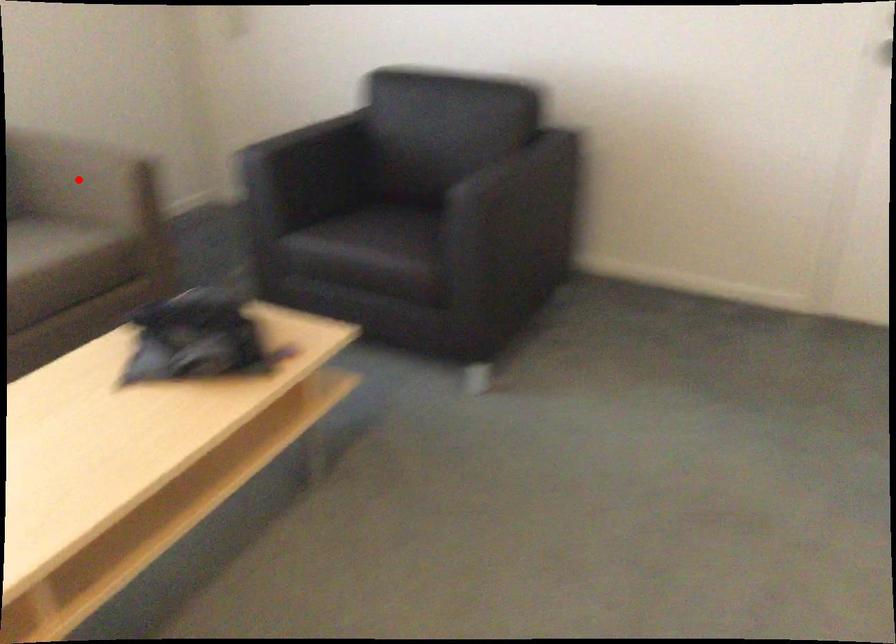
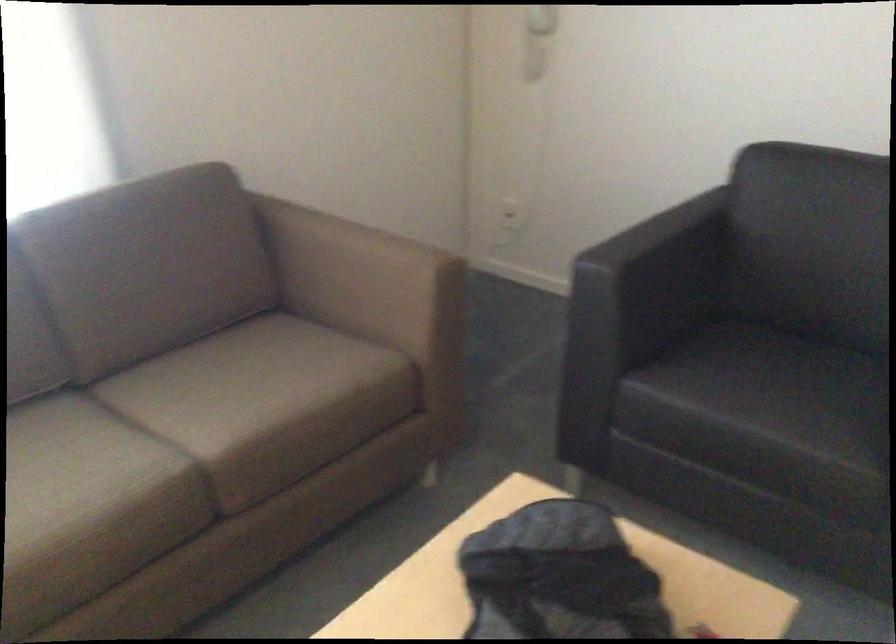
Question: I am providing you with two images of the same scene from different viewpoints. In image1, a red point is highlighted. Considering the same 3D point in image2, which of the following is correct?

Choices:
 (A) It is closer
 (B) It is farther

Answer: (A)